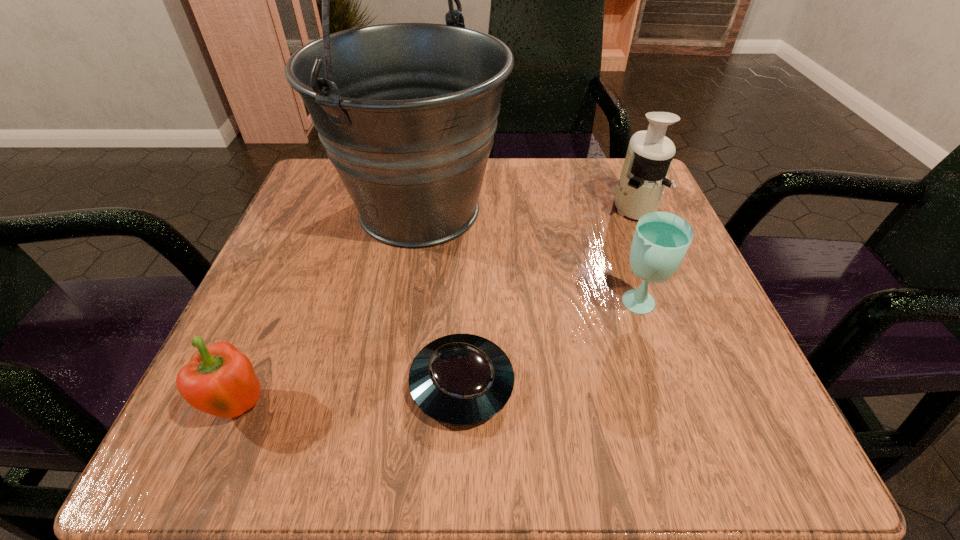
I want to click on object at the near left corner, so click(x=219, y=380).

You are a GUI agent. You are given a task and a screenshot of the screen. Output one action in this format:
    pyautogui.click(x=<x>, y=<y>)
    Task: Click on the object that is at the far right corner
    
    Given the screenshot: What is the action you would take?
    pyautogui.click(x=643, y=178)

The height and width of the screenshot is (540, 960). What are the coordinates of `free location at the far edge` in the screenshot? It's located at 547,170.

Find the location of a particular element. This screenshot has height=540, width=960. vacant space at the near edge of the desktop is located at coordinates (631, 437).

Find the location of a particular element. free space at the left edge of the desktop is located at coordinates [x=319, y=318].

Locate an element on the screen. The height and width of the screenshot is (540, 960). vacant position at the far left corner of the desktop is located at coordinates coord(312,222).

Identify the location of vacant area at the near right corner of the desktop. The width and height of the screenshot is (960, 540). (715, 408).

Identify the location of empty location between the tallest object and the pepper. Image resolution: width=960 pixels, height=540 pixels. (330, 308).

Image resolution: width=960 pixels, height=540 pixels. What are the coordinates of `free space that is in between the shortest object and the fourth tallest object` in the screenshot? It's located at (351, 395).

This screenshot has height=540, width=960. I want to click on empty space between the second tallest object and the pepper, so click(438, 306).